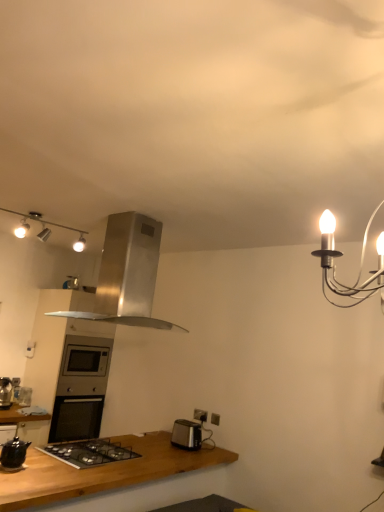
The width and height of the screenshot is (384, 512). In order to click on vacant area situated below matte black kettle at lower left (from a real-world perspective) in this screenshot , I will do `click(16, 463)`.